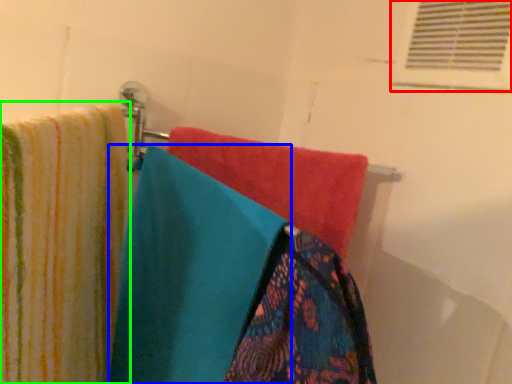
Question: Estimate the real-world distances between objects in this image. Which object is farther from shutter (highlighted by a red box), towel (highlighted by a blue box) or towel (highlighted by a green box)?

Choices:
 (A) towel
 (B) towel

Answer: (B)